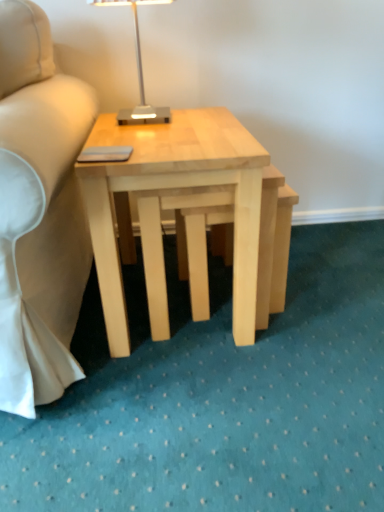
Question: Does natural wood step stool at center appear on the right side of natural wood coffee table at center?

Choices:
 (A) no
 (B) yes

Answer: (B)

Question: Is natural wood step stool at center closer to the viewer compared to natural wood coffee table at center?

Choices:
 (A) no
 (B) yes

Answer: (A)

Question: Is natural wood step stool at center turned away from natural wood coffee table at center?

Choices:
 (A) no
 (B) yes

Answer: (B)

Question: From a real-world perspective, is natural wood step stool at center on natural wood coffee table at center?

Choices:
 (A) no
 (B) yes

Answer: (A)

Question: Considering the relative sizes of natural wood step stool at center and natural wood coffee table at center in the image provided, is natural wood step stool at center taller than natural wood coffee table at center?

Choices:
 (A) no
 (B) yes

Answer: (A)

Question: Is natural wood coffee table at center taller or shorter than metallic silver table lamp at upper center?

Choices:
 (A) tall
 (B) short

Answer: (A)

Question: From a real-world perspective, relative to metallic silver table lamp at upper center, is natural wood coffee table at center vertically above or below?

Choices:
 (A) above
 (B) below

Answer: (B)

Question: Visually, is natural wood coffee table at center positioned to the left or to the right of metallic silver table lamp at upper center?

Choices:
 (A) right
 (B) left

Answer: (A)

Question: Would you say natural wood coffee table at center is inside or outside metallic silver table lamp at upper center?

Choices:
 (A) outside
 (B) inside

Answer: (A)

Question: Choose the correct answer: Is natural wood coffee table at center inside natural wood step stool at center or outside it?

Choices:
 (A) inside
 (B) outside

Answer: (B)

Question: Considering their positions, is natural wood coffee table at center located in front of or behind natural wood step stool at center?

Choices:
 (A) front
 (B) behind

Answer: (A)

Question: Considering the positions of natural wood coffee table at center and natural wood step stool at center in the image, is natural wood coffee table at center bigger or smaller than natural wood step stool at center?

Choices:
 (A) small
 (B) big

Answer: (B)

Question: Looking at their shapes, would you say natural wood coffee table at center is wider or thinner than natural wood step stool at center?

Choices:
 (A) wide
 (B) thin

Answer: (A)

Question: Does point (180, 262) appear closer or farther from the camera than point (130, 155)?

Choices:
 (A) farther
 (B) closer

Answer: (A)

Question: Is natural wood step stool at center to the left or to the right of natural wood coffee table at center in the image?

Choices:
 (A) left
 (B) right

Answer: (B)